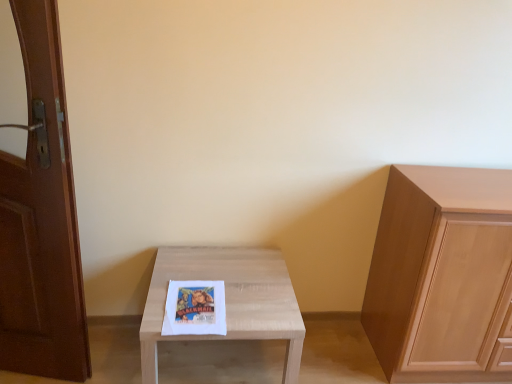
Question: Would you say brown wooden door at left is to the left or to the right of light wood table at center in the picture?

Choices:
 (A) right
 (B) left

Answer: (B)

Question: Is brown wooden door at left situated inside light wood table at center or outside?

Choices:
 (A) inside
 (B) outside

Answer: (B)

Question: Which object is the farthest from the brown wooden door at left?

Choices:
 (A) light wood cabinet at right
 (B) light wood table at center

Answer: (A)

Question: Estimate the real-world distances between objects in this image. Which object is farther from the light wood table at center?

Choices:
 (A) light wood cabinet at right
 (B) brown wooden door at left

Answer: (A)